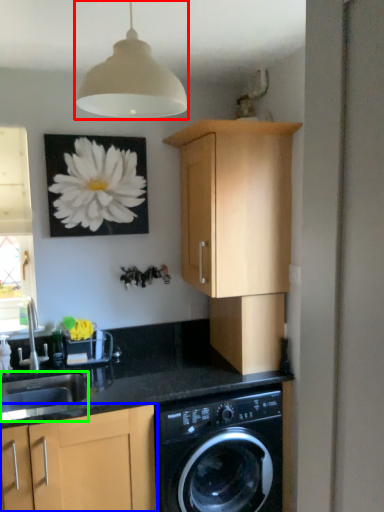
Question: Which is farther away from lamp (highlighted by a red box)? cabinetry (highlighted by a blue box) or sink (highlighted by a green box)?

Choices:
 (A) cabinetry
 (B) sink

Answer: (B)